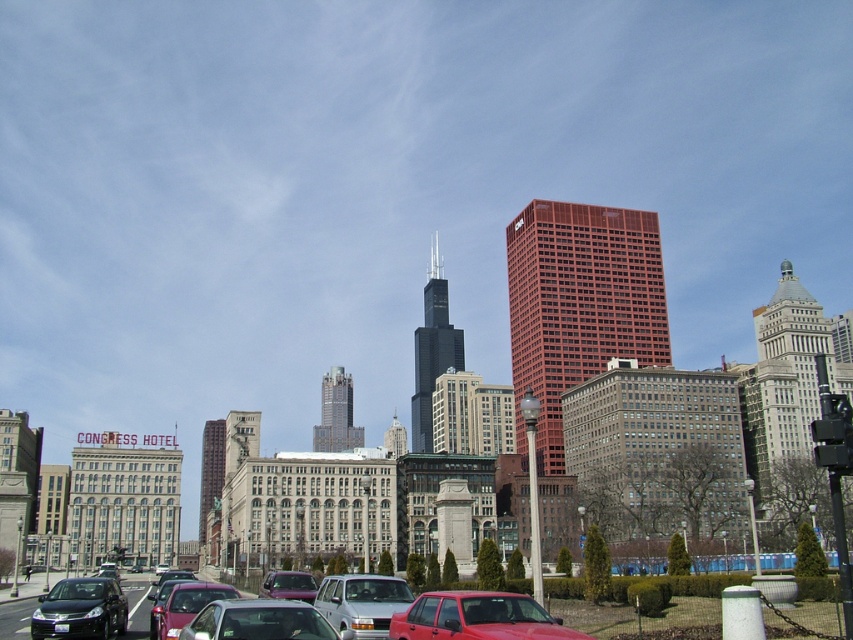
You are a delivery person needing to load a tall package into your vehicle. You see a matte silver car at center and a metallic purple car at center. Which car has enough vertical space to accommodate the package?

The matte silver car at center has a greater height compared to the metallic purple car at center, so it can accommodate the tall package.

You are a delivery person trying to park your vehicle in a narrow alley between the two skyscrapers. The alley is only wide enough for vehicles that are no more than 2.5 meters wide. You have a silver metallic van at center and a matte silver car at lower left. Which vehicle should you choose to fit through the alley?

The silver metallic van at center might be wider than matte silver car at lower left, so you should choose the matte silver car at lower left to ensure it fits through the alley.

You are a pedestrian standing at the intersection near the traffic light. You want to cross the street to reach the brown brick building at center. Is the matte silver car at lower left blocking your path?

The matte silver car at lower left is closer to the viewer than the brown brick building at center, so the car is in front of the building. This means the matte silver car at lower left is blocking your path to the brown brick building at center.